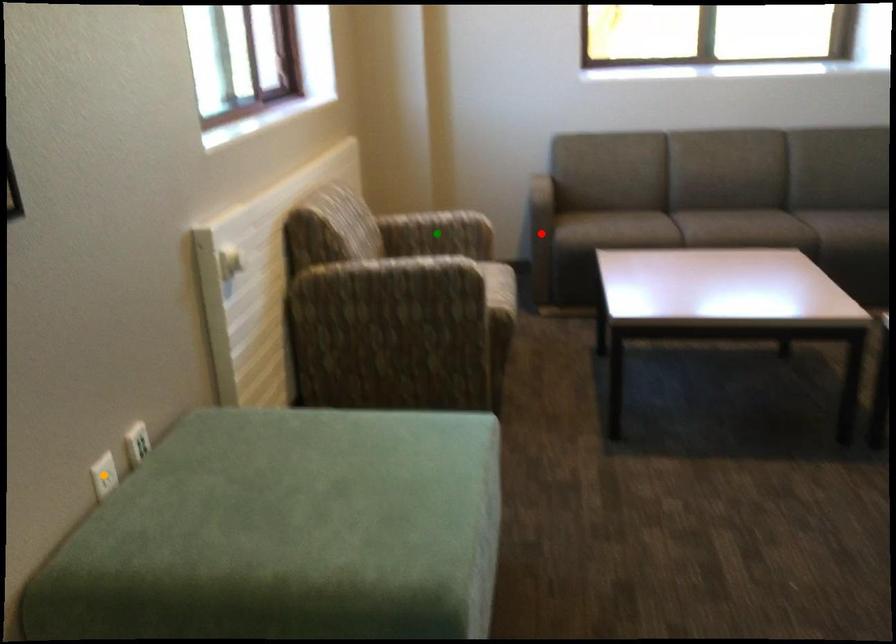
Order these from nearest to farthest:
A) orange point
B) green point
C) red point

1. orange point
2. green point
3. red point